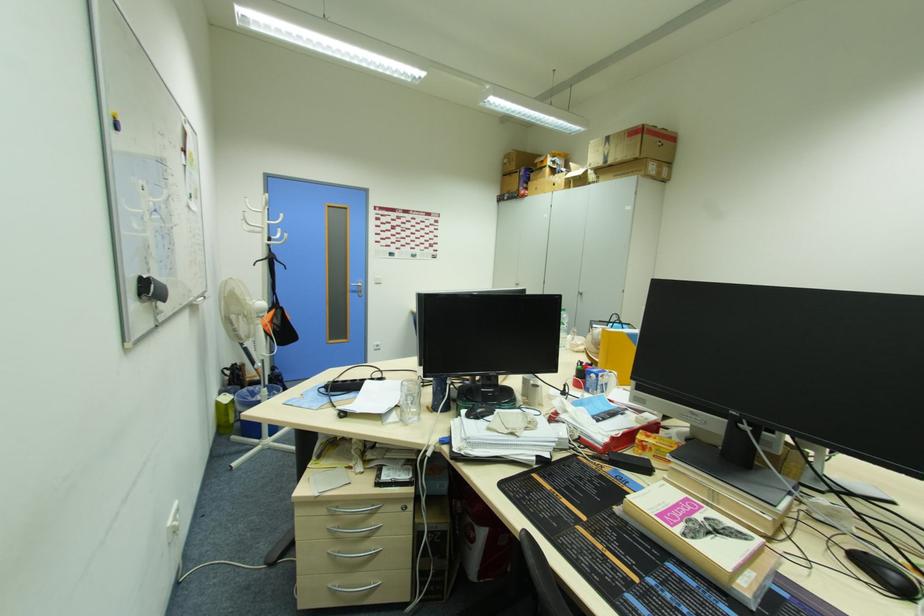
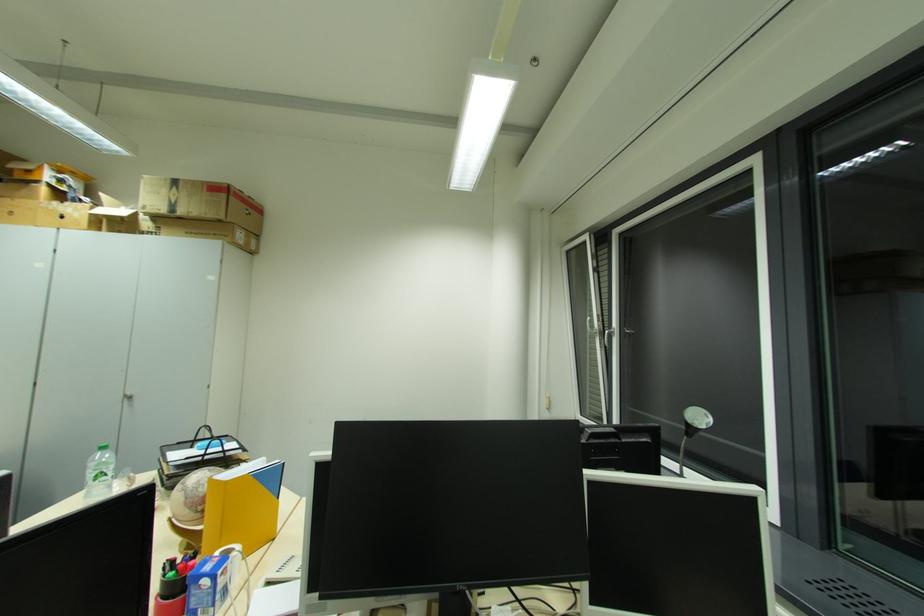
Locate, in the second image, the point that corresponds to (x=594, y=166) in the first image.

(152, 209)